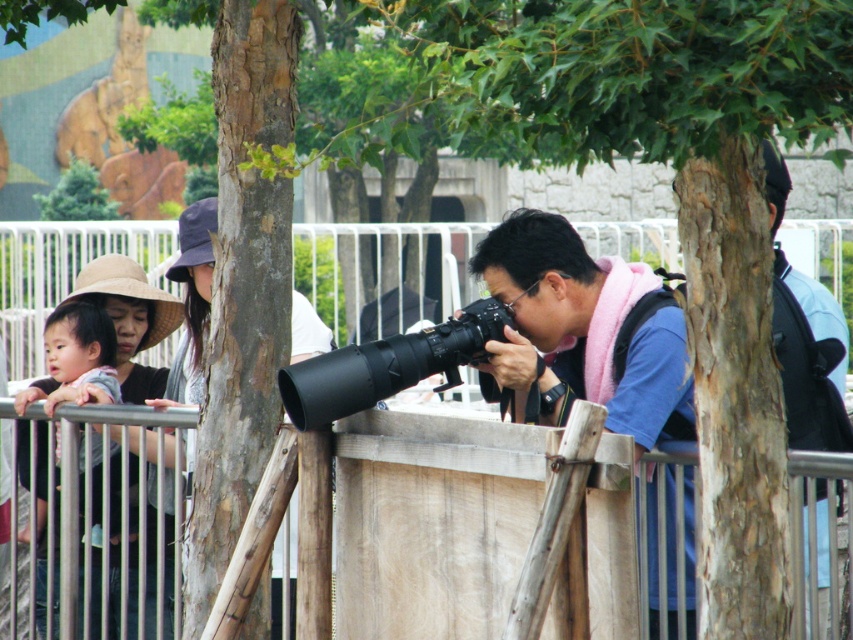
Does dark blue shirt at right have a greater width compared to matte gray hat at upper left?

Correct, the width of dark blue shirt at right exceeds that of matte gray hat at upper left.

Is point (784, 168) positioned behind point (196, 403)?

That is False.

Locate an element on the screen. This screenshot has width=853, height=640. dark blue shirt at right is located at coordinates (809, 358).

Who is more forward, (619, 301) or (300, 301)?

Point (619, 301) is more forward.

Who is shorter, blue fabric at center or matte gray hat at upper left?

matte gray hat at upper left

Find the location of a particular element. blue fabric at center is located at coordinates (585, 330).

Is wooden at center to the right of dark blue shirt at right from the viewer's perspective?

No, wooden at center is not to the right of dark blue shirt at right.

Who is positioned more to the left, wooden at center or dark blue shirt at right?

From the viewer's perspective, wooden at center appears more on the left side.

What do you see at coordinates (379, 269) in the screenshot?
I see `wooden at center` at bounding box center [379, 269].

Image resolution: width=853 pixels, height=640 pixels. Identify the location of wooden at center. (379, 269).